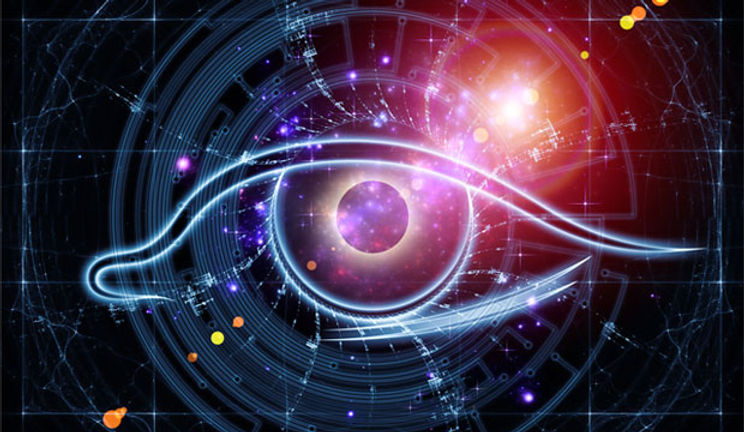
I want to click on bright white light, so click(522, 100), click(513, 111).